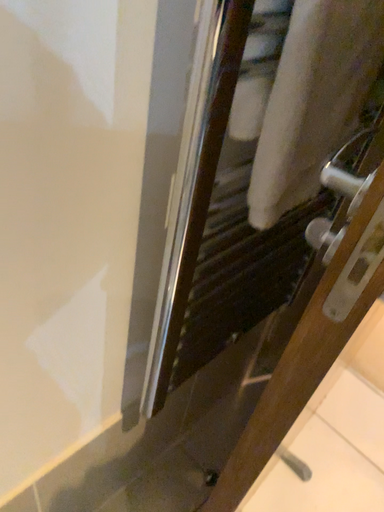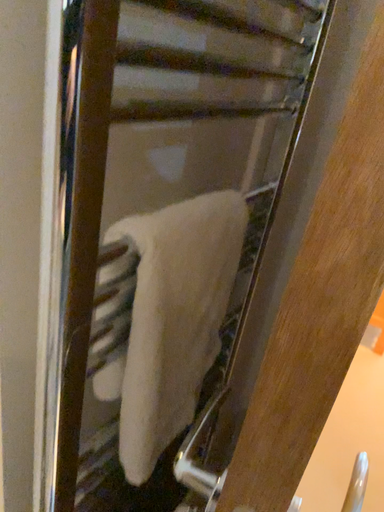
Question: Which way did the camera rotate in the video?

Choices:
 (A) rotated upward
 (B) rotated downward

Answer: (A)